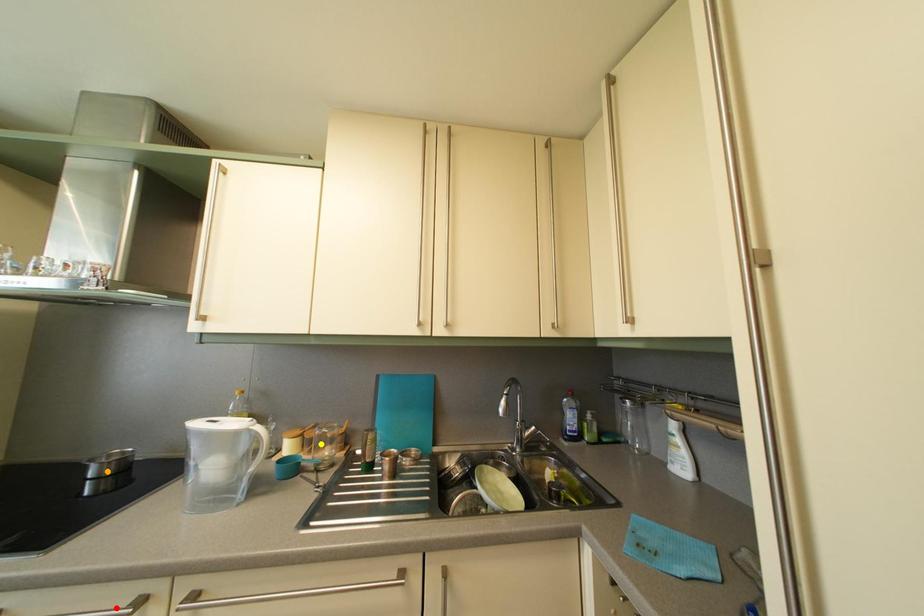
Order these from nearest to farthest:
yellow point, red point, orange point

red point, orange point, yellow point